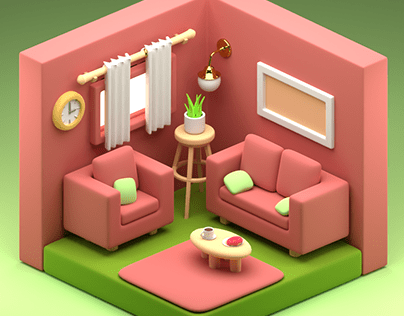
You are a GUI agent. You are given a task and a screenshot of the screen. Output one action in this format:
    pyautogui.click(x=<x>, y=<y>)
    Task: Click on the clock
    The width and height of the screenshot is (404, 316).
    Given the screenshot: What is the action you would take?
    pyautogui.click(x=72, y=96)